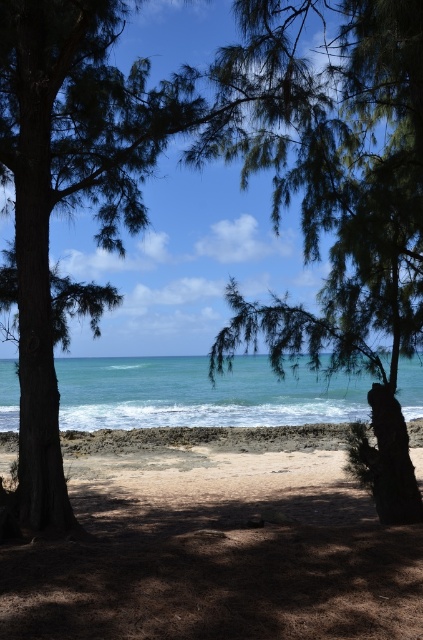
Question: Is brown sandy beach at center to the left of blue water at center from the viewer's perspective?

Choices:
 (A) no
 (B) yes

Answer: (B)

Question: Which point appears closest to the camera in this image?

Choices:
 (A) (154, 420)
 (B) (315, 253)
 (C) (310, 476)

Answer: (B)

Question: Is green leafy tree at center bigger than blue water at center?

Choices:
 (A) no
 (B) yes

Answer: (A)

Question: Is brown sandy beach at center positioned in front of blue water at center?

Choices:
 (A) no
 (B) yes

Answer: (B)

Question: Among these objects, which one is farthest from the camera?

Choices:
 (A) brown sandy beach at center
 (B) green leafy tree at center

Answer: (B)

Question: Which point is closer to the camera?

Choices:
 (A) tap(271, 404)
 (B) tap(244, 445)
 (C) tap(408, 230)

Answer: (C)